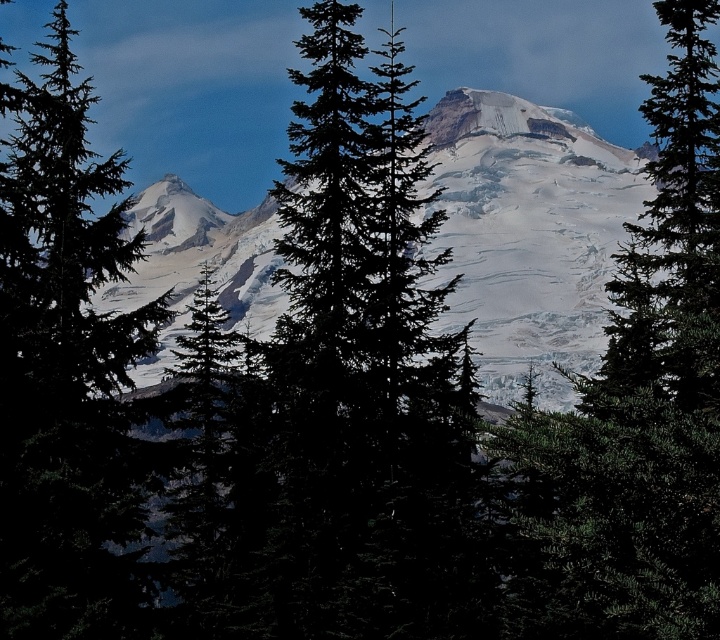
Can you confirm if green matte tree at center is taller than snowy granite mountain at center?

Correct, green matte tree at center is much taller as snowy granite mountain at center.

Who is taller, green matte tree at center or snowy granite mountain at center?

green matte tree at center

I want to click on green matte tree at center, so click(x=636, y=403).

Which is in front, point (26, 323) or point (540, 134)?

Point (26, 323) is more forward.

In the scene shown: Measure the distance from green matte tree at left to white snow-covered peak at center.

The distance of green matte tree at left from white snow-covered peak at center is 77.63 meters.

Where is `green matte tree at left`? This screenshot has height=640, width=720. green matte tree at left is located at coordinates (66, 371).

Where is `green matte tree at left`? green matte tree at left is located at coordinates (66, 371).

Which is more to the left, green matte tree at center or white snow-covered peak at center?

white snow-covered peak at center is more to the left.

Between point (612, 529) and point (541, 113), which one is positioned behind?

Point (541, 113)

This screenshot has width=720, height=640. What are the coordinates of `green matte tree at center` in the screenshot? It's located at (636, 403).